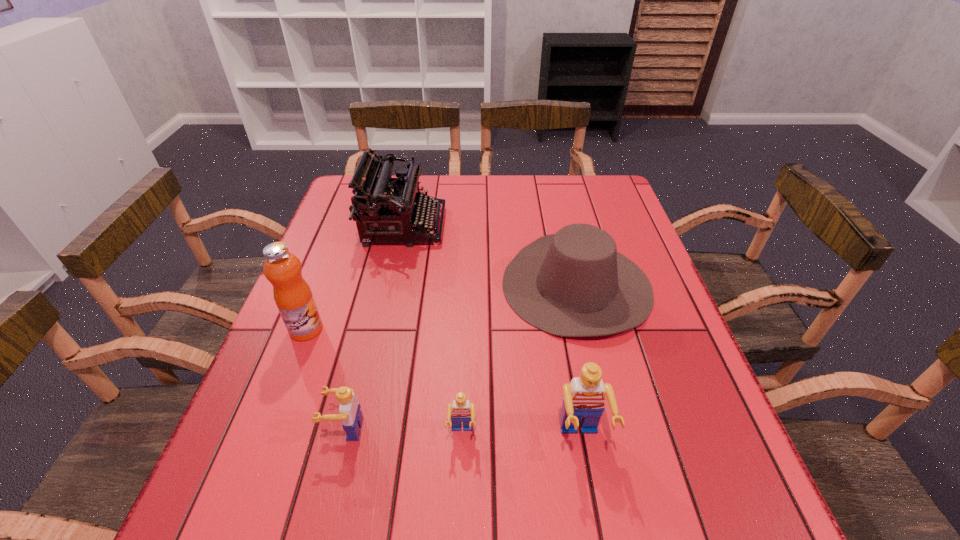
You are a GUI agent. You are given a task and a screenshot of the screen. Output one action in this format:
    pyautogui.click(x=<x>, y=<y>)
    Task: Click on the unoccupied area between the tallest Lego and the leftmost object
    
    Given the screenshot: What is the action you would take?
    pyautogui.click(x=444, y=384)

What are the coordinates of `empty space that is in between the fruit juice and the cowboy hat` in the screenshot? It's located at (442, 307).

At what (x,y) coordinates should I click in order to perform the action: click on vacant area that lies between the leftmost object and the second Lego from right to left. Please return your answer as a coordinate pair (x, y). The width and height of the screenshot is (960, 540). Looking at the image, I should click on (384, 381).

Select which object is the closest to the third object from right to left. Please provide its 2D coordinates. Your answer should be formatted as a tuple, i.e. [(x, y)], where the tuple contains the x and y coordinates of a point satisfying the conditions above.

[(584, 397)]

Image resolution: width=960 pixels, height=540 pixels. Find the location of `object that is the third nearest to the cowboy hat`. object that is the third nearest to the cowboy hat is located at coordinates (460, 410).

You are a GUI agent. You are given a task and a screenshot of the screen. Output one action in this format:
    pyautogui.click(x=<x>, y=<y>)
    Task: Click on the Lego identified as the second closest to the rightmost Lego
    This screenshot has width=960, height=540.
    Given the screenshot: What is the action you would take?
    pyautogui.click(x=350, y=415)

Locate an element on the screen. the third closest Lego to the typewriter is located at coordinates (584, 397).